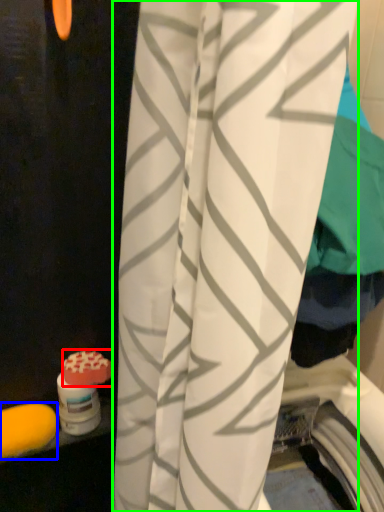
Question: Which object is the closest to the soap (highlighted by a red box)? Choose among these: soap (highlighted by a blue box) or curtain (highlighted by a green box).

Choices:
 (A) soap
 (B) curtain

Answer: (A)